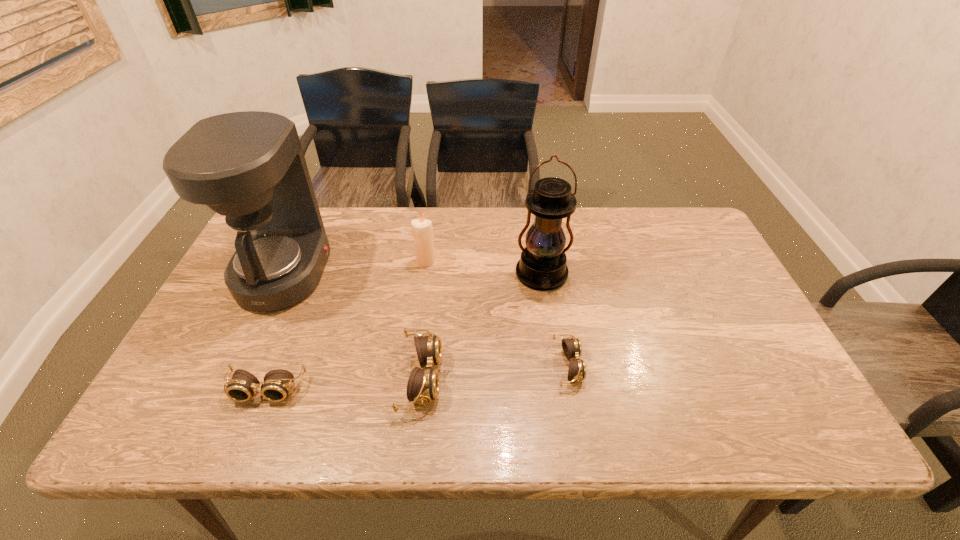
Locate an element on the screen. Image resolution: width=960 pixels, height=540 pixels. vacant area at the near edge is located at coordinates (295, 370).

Where is `free space at the left edge of the desktop`? free space at the left edge of the desktop is located at coordinates (218, 346).

This screenshot has width=960, height=540. Identify the location of vacant space at the near left corner of the desktop. (196, 371).

Where is `vacant area that lies between the fourth shortest object and the fifth shortest object`? The width and height of the screenshot is (960, 540). vacant area that lies between the fourth shortest object and the fifth shortest object is located at coordinates (484, 268).

Identify the location of unoccupied area between the shortest object and the third shortest object. (494, 372).

Where is `free point between the second goggles from left to right and the fourth shortest object`? free point between the second goggles from left to right and the fourth shortest object is located at coordinates (423, 319).

At what (x,y) coordinates should I click in order to perform the action: click on blank region between the lantern and the shortest object. Please return your answer as a coordinate pair (x, y). Looking at the image, I should click on (555, 320).

The image size is (960, 540). I want to click on unoccupied position between the candle and the second tallest goggles, so click(x=347, y=325).

What are the coordinates of `free space between the second goggles from left to right and the shortest object` in the screenshot? It's located at pos(494,372).

Where is `free spot between the tallest goggles and the coffee maker`? Image resolution: width=960 pixels, height=540 pixels. free spot between the tallest goggles and the coffee maker is located at coordinates (352, 325).